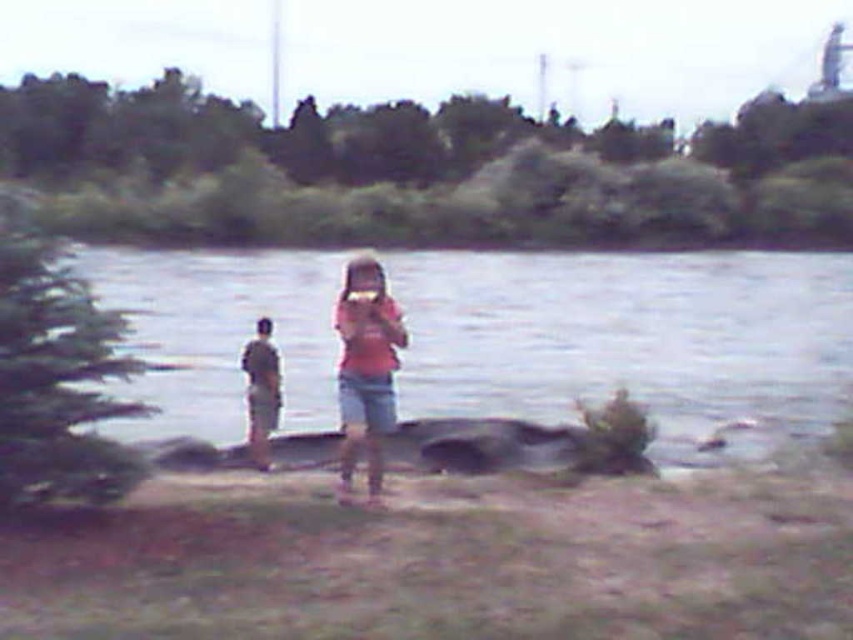
Is point (764, 266) in front of point (265, 394)?

That is False.

Can you confirm if gray smooth rock at center is positioned to the left of light brown wooden stick at left?

Indeed, gray smooth rock at center is positioned on the left side of light brown wooden stick at left.

The height and width of the screenshot is (640, 853). I want to click on gray smooth rock at center, so click(x=631, y=339).

This screenshot has height=640, width=853. In order to click on gray smooth rock at center in this screenshot , I will do `click(631, 339)`.

Can you confirm if pink matte shirt at center is positioned to the left of light brown wooden stick at left?

In fact, pink matte shirt at center is to the right of light brown wooden stick at left.

Can you confirm if pink matte shirt at center is positioned to the right of light brown wooden stick at left?

Correct, you'll find pink matte shirt at center to the right of light brown wooden stick at left.

Is point (346, 280) positioned before point (262, 416)?

Yes, it is in front of point (262, 416).

I want to click on pink matte shirt at center, so click(366, 365).

Can you confirm if gray smooth rock at center is smaller than pink matte shirt at center?

No.

Which is behind, point (553, 307) or point (376, 413)?

The point (553, 307) is behind.

The height and width of the screenshot is (640, 853). Find the location of `gray smooth rock at center`. gray smooth rock at center is located at coordinates (631, 339).